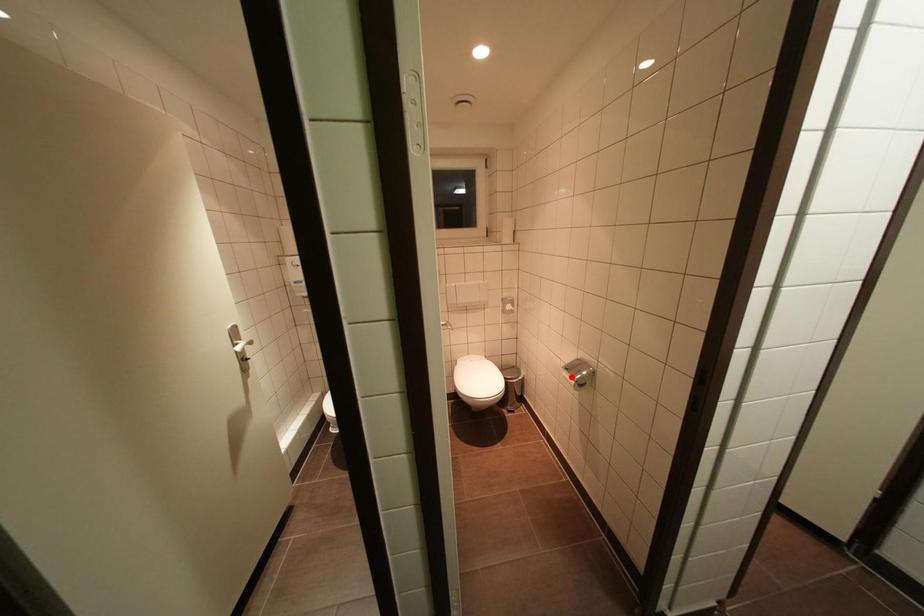
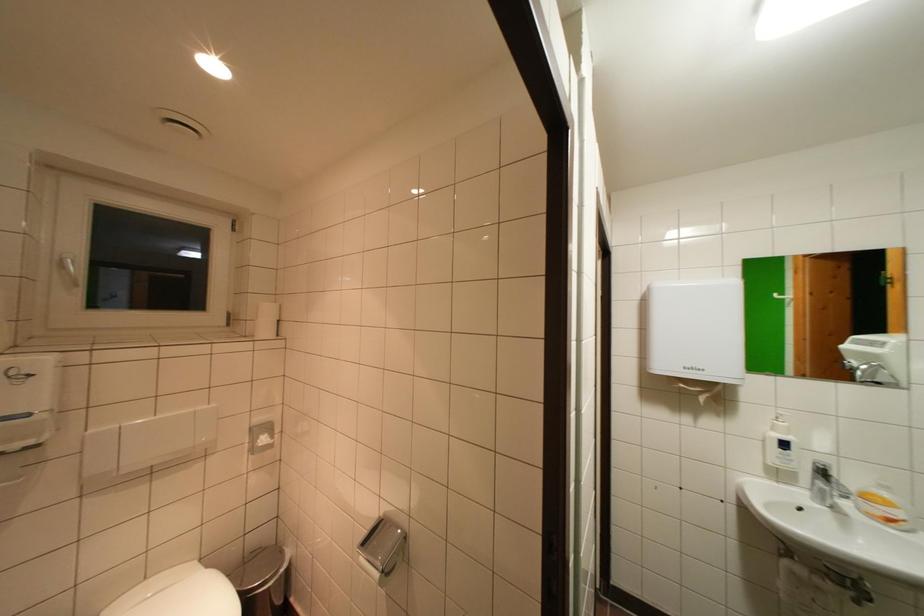
Locate, in the second image, the point that corresponds to the highlighted location in the first image.

(370, 562)